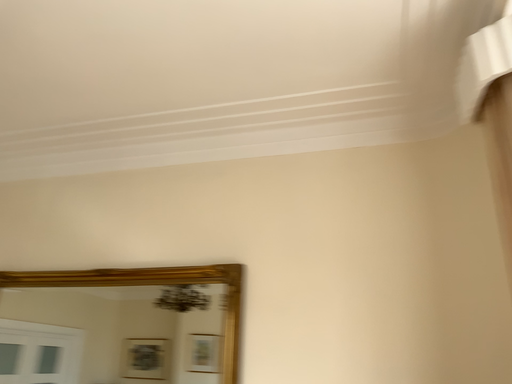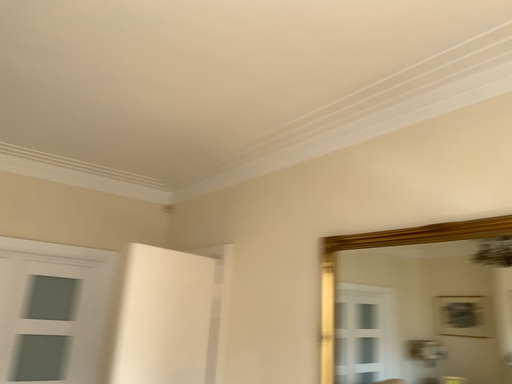
Question: How did the camera likely rotate when shooting the video?

Choices:
 (A) rotated upward
 (B) rotated downward

Answer: (B)